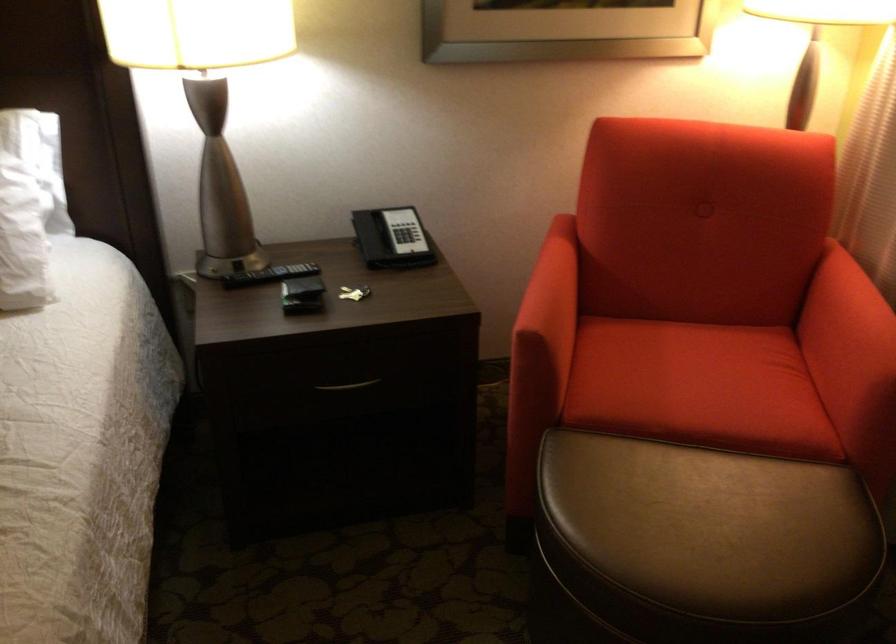
Question: The camera is either moving clockwise (left) or counter-clockwise (right) around the object. The first image is from the beginning of the video and the second image is from the end. Is the camera moving left or right when shooting the video?

Choices:
 (A) Left
 (B) Right

Answer: (A)